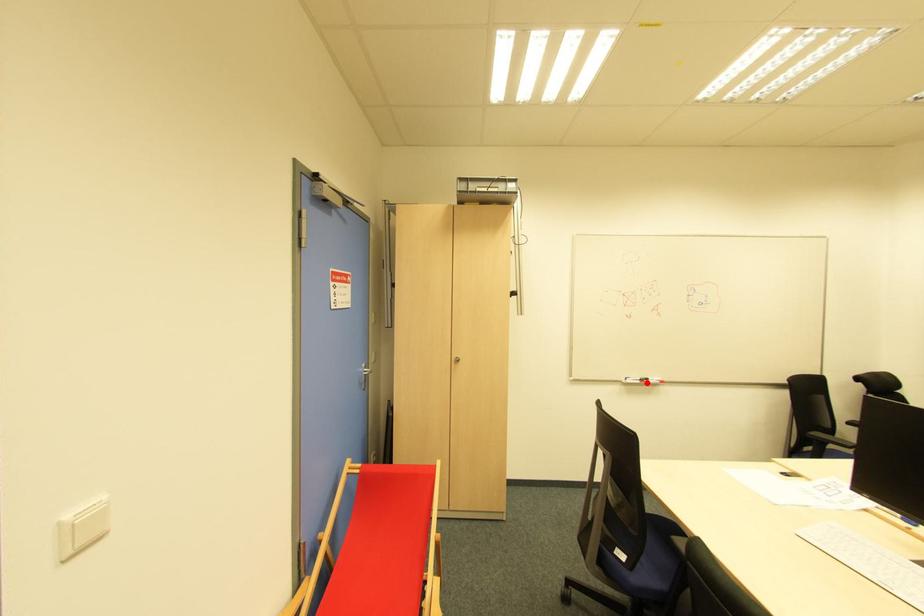
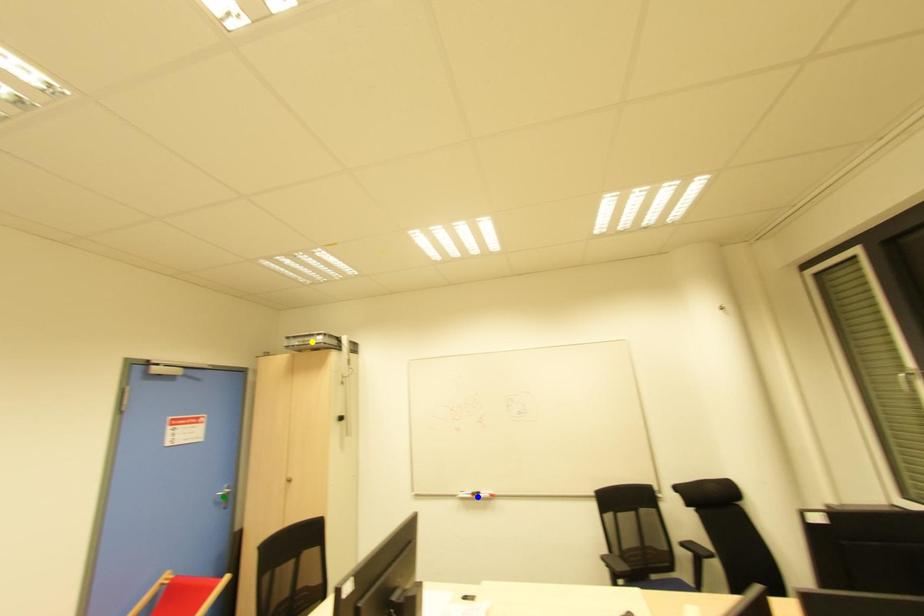
Question: I am providing you with two images of the same scene from different viewpoints. A red point is marked on the first image. You are given multiple points on the second image. Which point in image 2 is actually the same real-world point as the red point in image 1?

Choices:
 (A) yellow point
 (B) green point
 (C) blue point

Answer: (C)